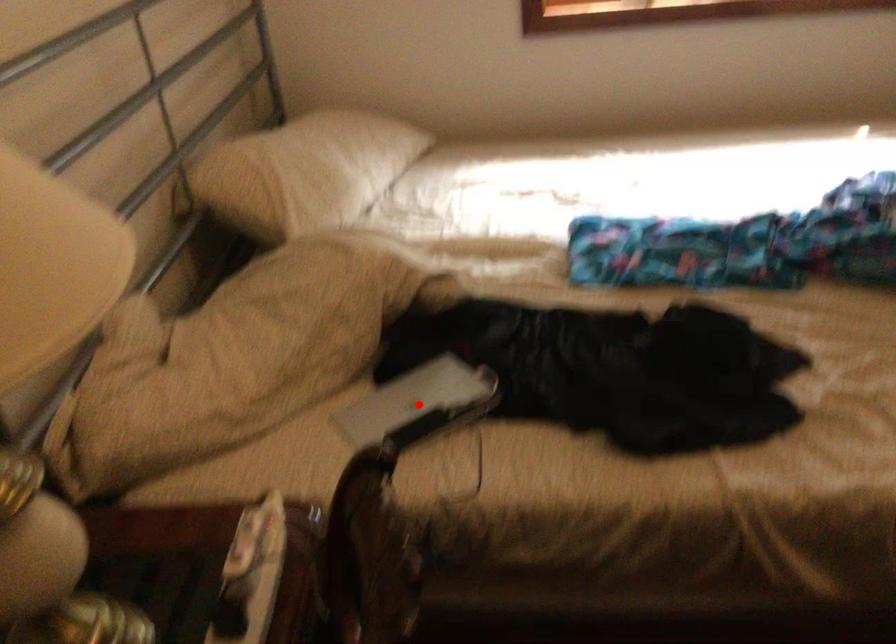
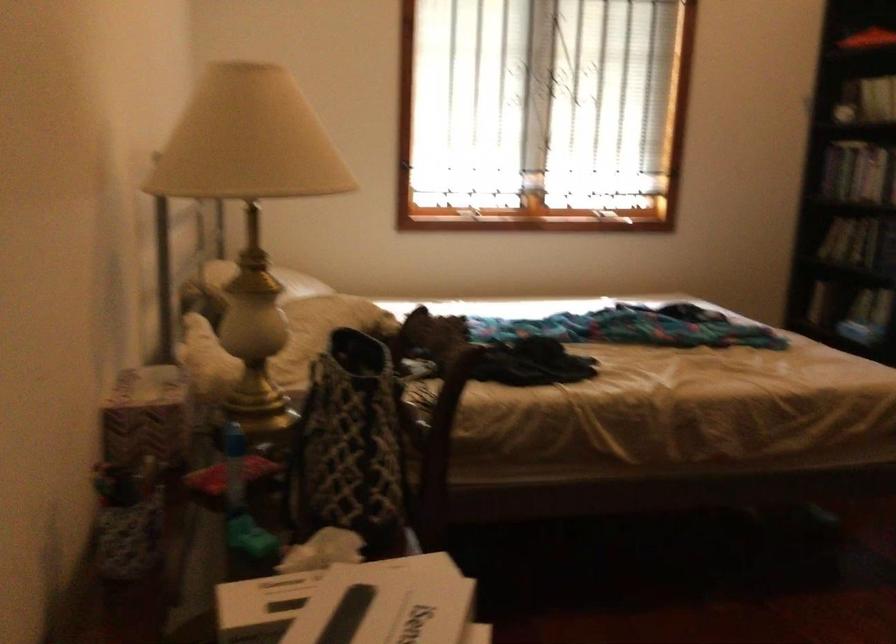
Question: I am providing you with two images of the same scene from different viewpoints. A red point is marked on the first image. Is the red point's position out of view in image 2?

Choices:
 (A) Yes
 (B) No

Answer: (A)